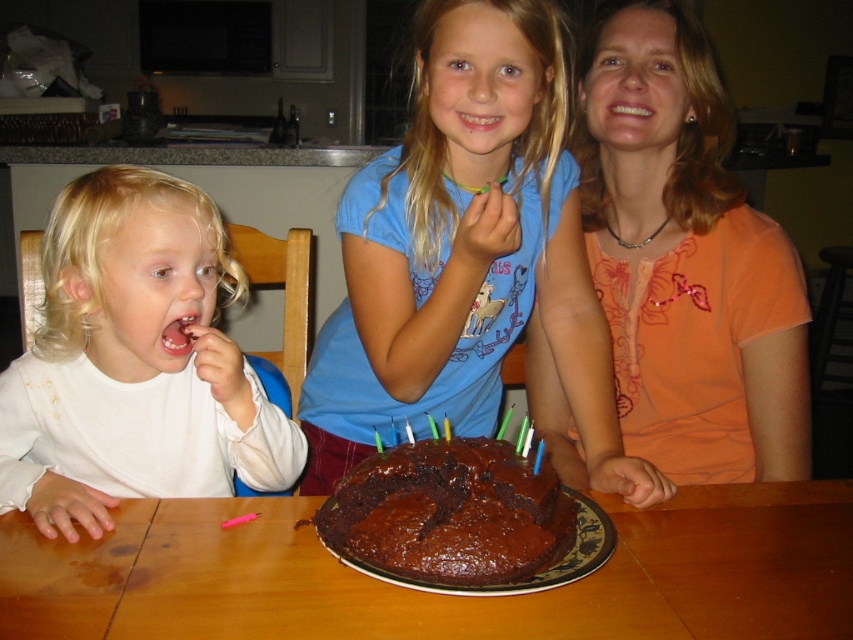
Question: Can you confirm if white matte shirt at left is positioned to the left of chocolate matte cake at center?

Choices:
 (A) yes
 (B) no

Answer: (A)

Question: Which point is closer to the camera?

Choices:
 (A) (173, 598)
 (B) (434, 568)
 (C) (471, 374)
 (D) (62, 346)

Answer: (B)

Question: Which object appears farthest from the camera in this image?

Choices:
 (A) brown wooden table at center
 (B) chocolate matte cake at center

Answer: (B)

Question: Can you confirm if white matte shirt at left is positioned to the right of chocolate matte cake at center?

Choices:
 (A) no
 (B) yes

Answer: (A)

Question: Is matte chocolate cake at center bigger than chocolate matte cake at center?

Choices:
 (A) yes
 (B) no

Answer: (A)

Question: Which point appears farthest from the camera in this image?

Choices:
 (A) (437, 512)
 (B) (682, 550)
 (C) (210, 346)

Answer: (C)